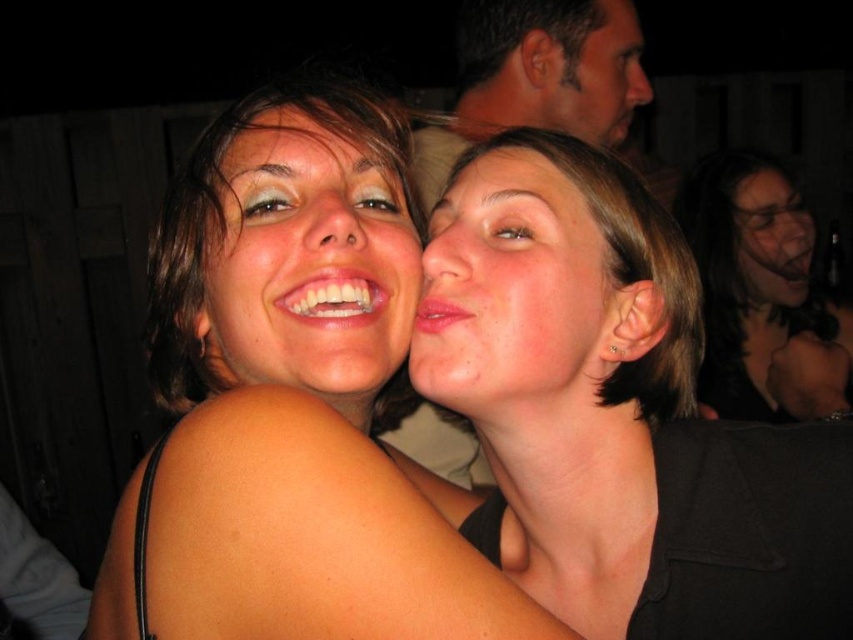
You are a photographer adjusting your camera settings to focus on the smooth black hair at upper right and the matte skin face at upper right. Since the camera can only focus on one plane at a time, which object should you prioritize focusing on to ensure the subject appears sharp?

The smooth black hair at upper right is closer to the viewer than the matte skin face at upper right. In low light conditions, focusing on the closer object, which is the smooth black hair at upper right, will help achieve a sharper focus because it is within the camera focus plane.

You are a photographer trying to capture a closeup shot of the matte skin at center. You know that your camera requires at least 12 inches of distance to focus properly. Based on the scene, can you determine if you are far enough away to take the photo?

The matte skin at center and viewer are 16.77 inches apart from each other, which is more than the required 12 inches. Therefore, you are far enough away to take the photo.